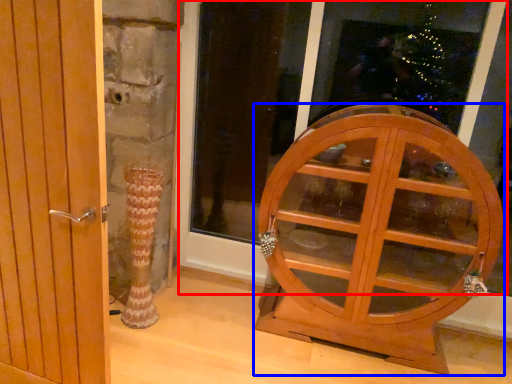
Question: Which object appears farthest to the camera in this image, window frame (highlighted by a red box) or furniture (highlighted by a blue box)?

Choices:
 (A) window frame
 (B) furniture

Answer: (A)